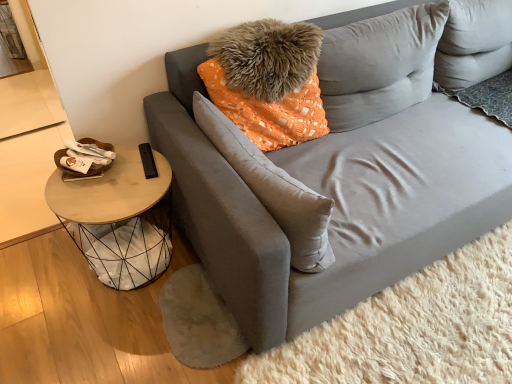
The height and width of the screenshot is (384, 512). In order to click on vacant area on top of woodenmaterial/texture side table at left (from a real-world perspective) in this screenshot , I will do `click(110, 185)`.